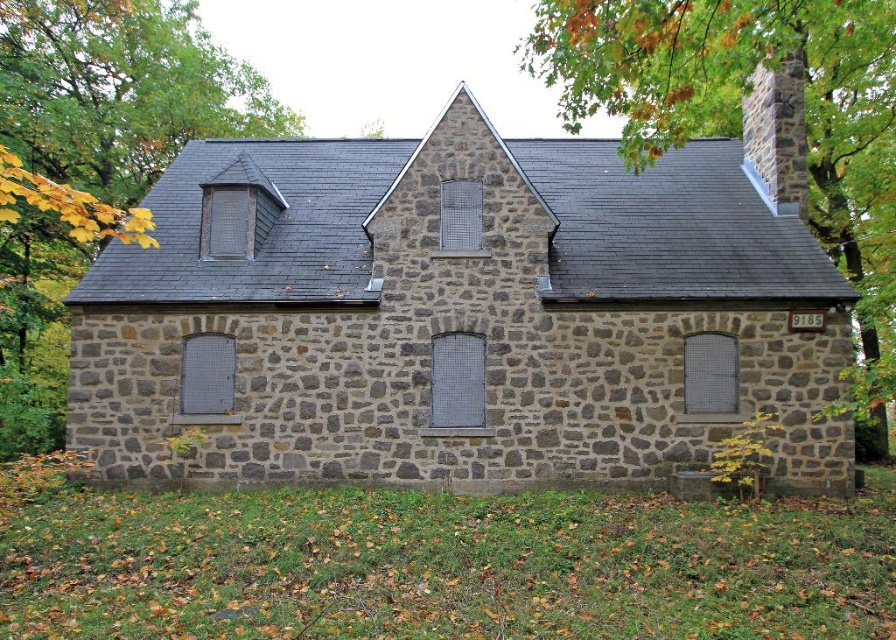
Question: Is the position of gray stone chapel at center less distant than that of stone chimney at upper right?

Choices:
 (A) no
 (B) yes

Answer: (B)

Question: Which point is closer to the camera?

Choices:
 (A) (764, 141)
 (B) (204, 337)
 (C) (564, 54)

Answer: (C)

Question: Which of these objects is positioned closest to the gray stone chapel at center?

Choices:
 (A) stone chimney at upper right
 (B) green leafy tree at upper right

Answer: (A)

Question: Can you confirm if green leafy tree at upper right is positioned above stone chimney at upper right?

Choices:
 (A) yes
 (B) no

Answer: (A)

Question: Estimate the real-world distances between objects in this image. Which object is closer to the green leafy tree at upper right?

Choices:
 (A) stone chimney at upper right
 (B) gray stone chapel at center

Answer: (A)

Question: Does green leafy tree at upper right appear under stone chimney at upper right?

Choices:
 (A) no
 (B) yes

Answer: (A)